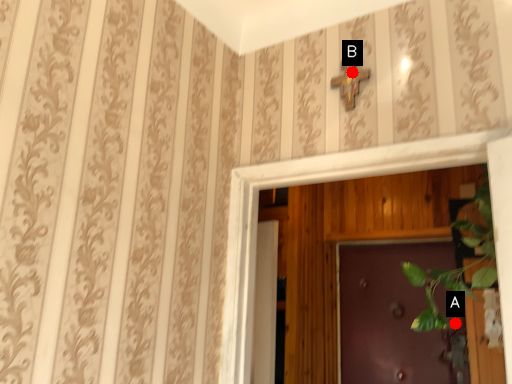
Question: Two points are circled on the image, labeled by A and B beside each circle. Which point is closer to the camera?

Choices:
 (A) A is closer
 (B) B is closer

Answer: (B)